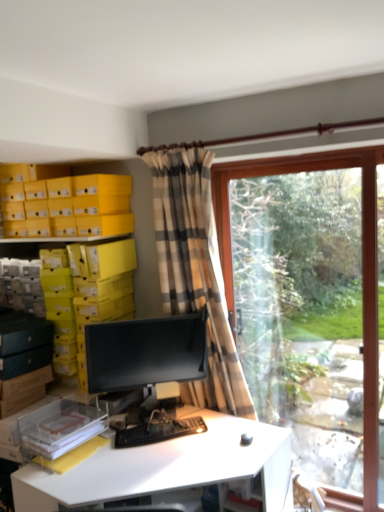
Find the location of a particular element. free point above clear glass window at right (from a real-world perspective) is located at coordinates (281, 161).